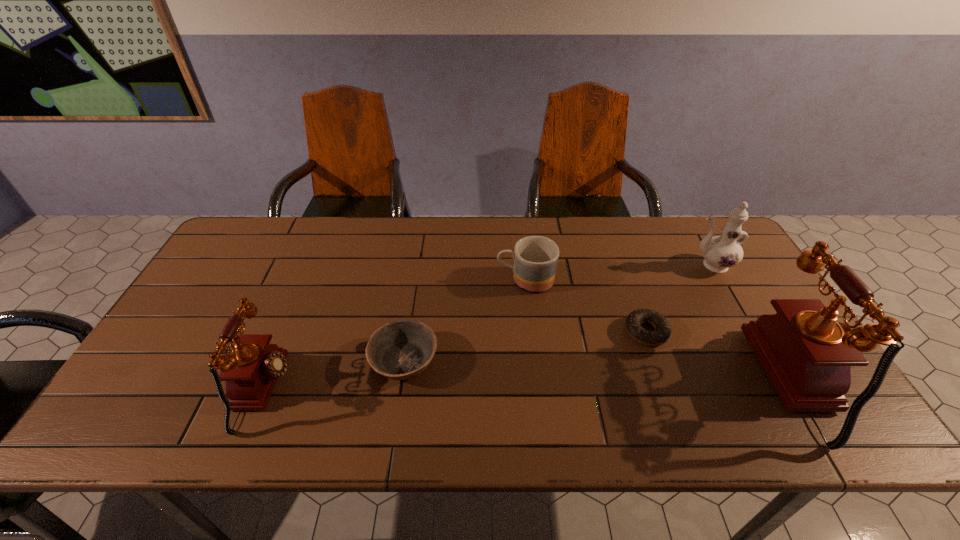
What are the coordinates of `object located at the far edge` in the screenshot? It's located at [720, 252].

This screenshot has height=540, width=960. I want to click on bowl that is at the near edge, so click(x=399, y=350).

At what (x,y) coordinates should I click in order to perform the action: click on telephone present at the right edge. Please return your answer as a coordinate pair (x, y). The width and height of the screenshot is (960, 540). Looking at the image, I should click on (807, 355).

You are a GUI agent. You are given a task and a screenshot of the screen. Output one action in this format:
    pyautogui.click(x=<x>, y=<y>)
    Task: Click on the chinaware that is positioned at the right edge
    The height and width of the screenshot is (540, 960).
    Given the screenshot: What is the action you would take?
    pyautogui.click(x=720, y=252)

Where is `object present at the far right corner`? The image size is (960, 540). object present at the far right corner is located at coordinates pos(720,252).

Locate an element on the screen. The width and height of the screenshot is (960, 540). object that is at the near right corner is located at coordinates (807, 355).

At what (x,y) coordinates should I click in order to perform the action: click on vacant space at the far edge of the desktop. Please return your answer as a coordinate pair (x, y). This screenshot has height=540, width=960. Looking at the image, I should click on (626, 235).

Locate an element on the screen. vacant space at the near edge of the desktop is located at coordinates (538, 377).

In the image, there is a desktop. Identify the location of blank space at the right edge. (756, 315).

At what (x,y) coordinates should I click in order to perform the action: click on vacant space at the near right corner. Please return your answer as a coordinate pair (x, y). Image resolution: width=960 pixels, height=540 pixels. Looking at the image, I should click on (757, 379).